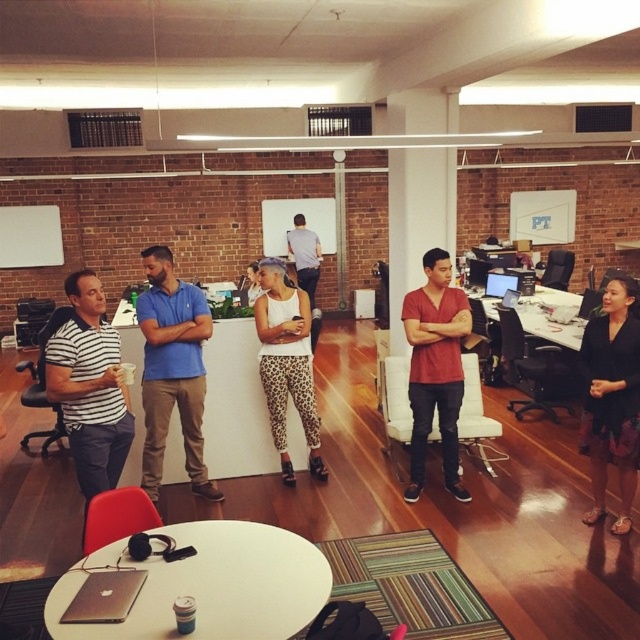
Is matte red t-shirt at center wider than glossy plastic monitor at center?

Indeed, matte red t-shirt at center has a greater width compared to glossy plastic monitor at center.

The height and width of the screenshot is (640, 640). In order to click on matte red t-shirt at center in this screenshot , I will do `click(435, 369)`.

Where is `matte red t-shirt at center`? Image resolution: width=640 pixels, height=640 pixels. matte red t-shirt at center is located at coordinates [435, 369].

Does black fabric skirt at lower right have a greater height compared to matte red t-shirt at center?

No, black fabric skirt at lower right is not taller than matte red t-shirt at center.

Is point (624, 323) farther from viewer compared to point (448, 348)?

No.

I want to click on black fabric skirt at lower right, so click(x=612, y=396).

Does blue cotton polo shirt at center lie in front of glossy plastic monitor at center?

Yes, it is.

Where is `blue cotton polo shirt at center`? blue cotton polo shirt at center is located at coordinates (172, 369).

I want to click on blue cotton polo shirt at center, so click(172, 369).